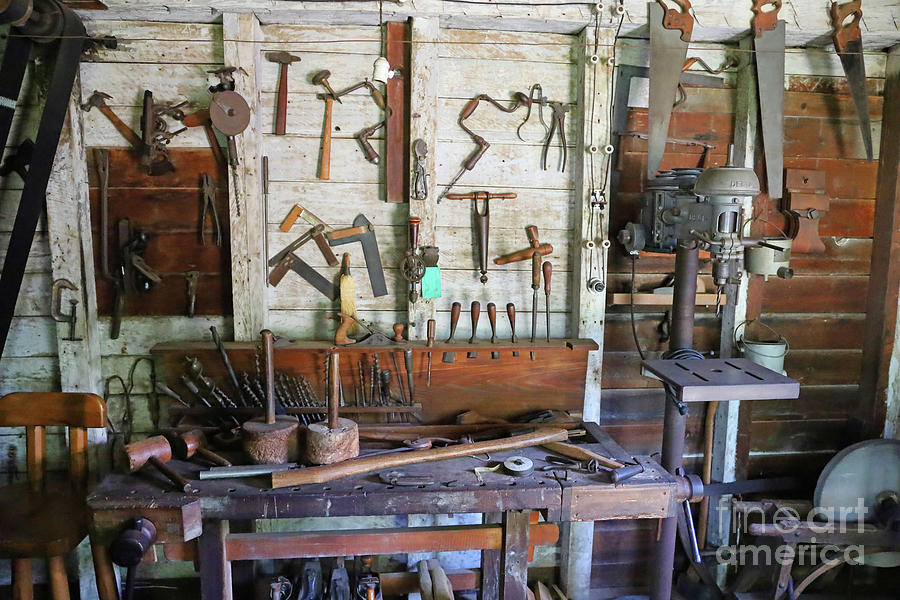
Identify the location of wooden chair. (58, 502).